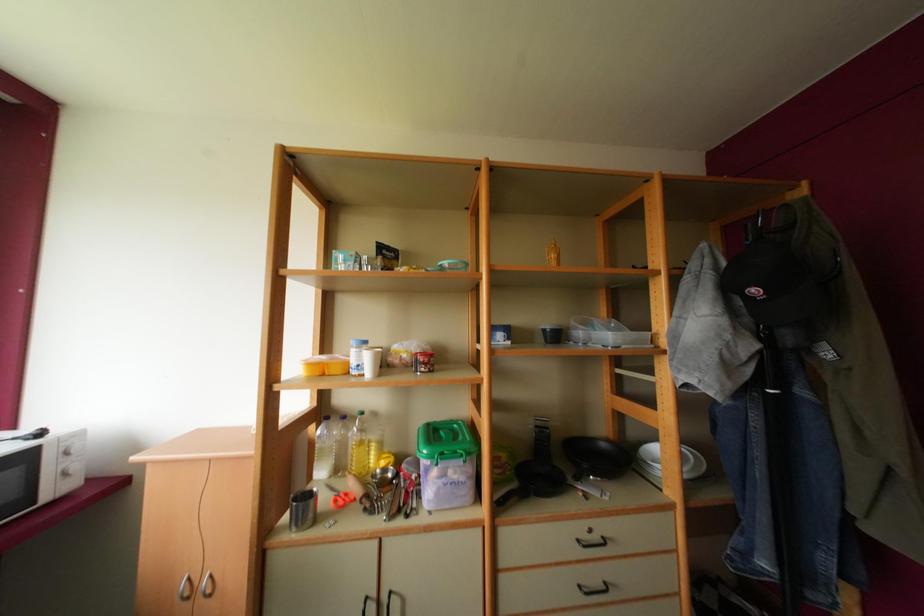
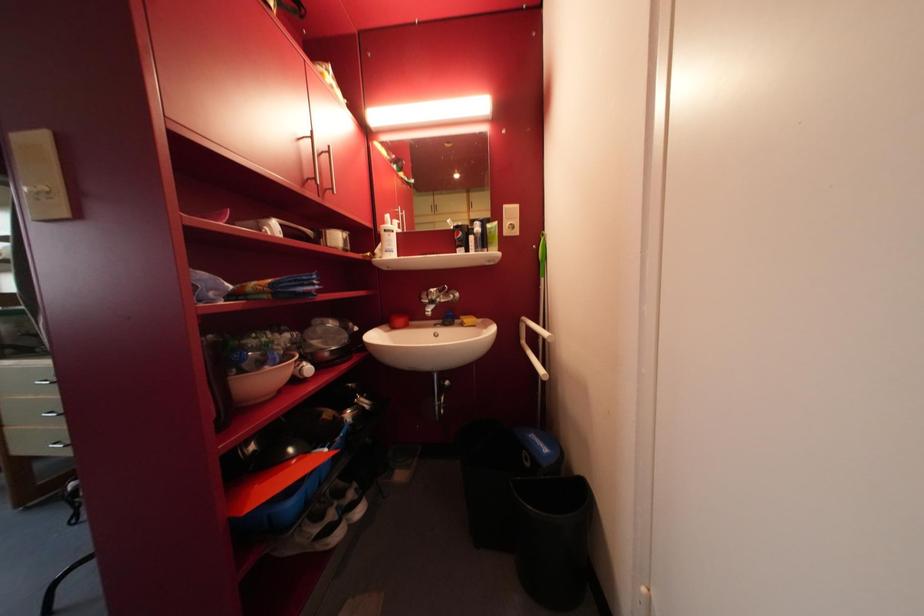
Question: Which direction would the cameraman need to move to produce the second image? Reply with the corresponding letter.

Choices:
 (A) Left
 (B) Right
 (C) Forward
 (D) Backward

Answer: (B)